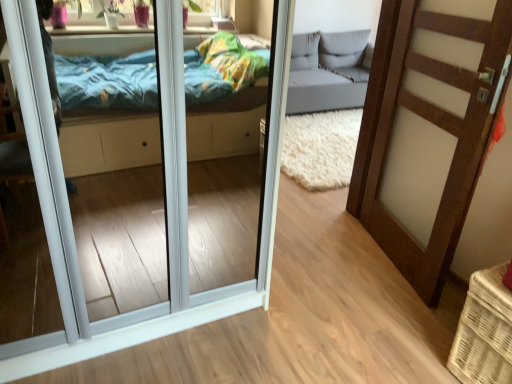
Find the location of a particular element. vacant area situated below white glossy door at center, positioned as the 1th door in left-to-right order (from a real-world perspective) is located at coordinates (133, 292).